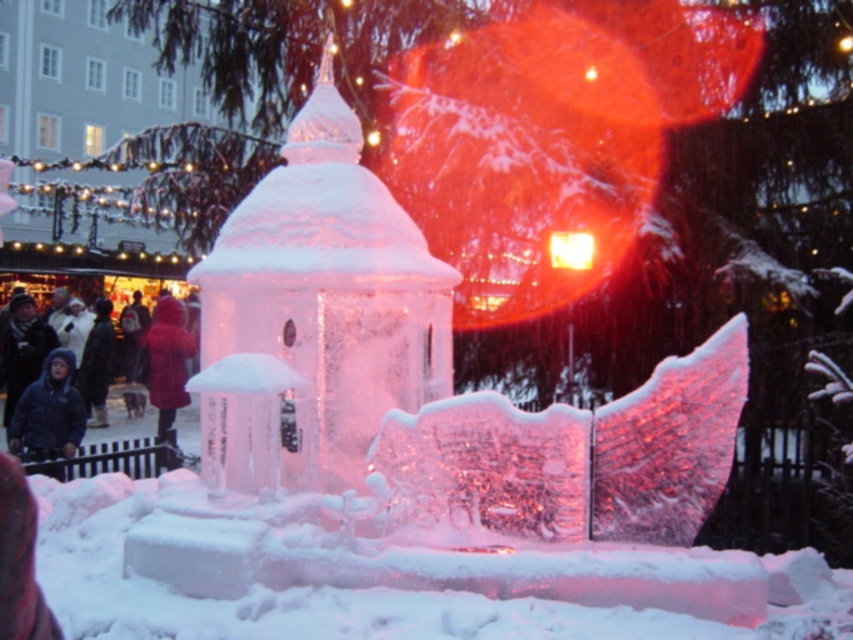
Is blue woolen jacket at lower left taller than red wool coat at center?

Incorrect, blue woolen jacket at lower left's height is not larger of red wool coat at center's.

Is blue woolen jacket at lower left positioned at the back of red wool coat at center?

No, blue woolen jacket at lower left is closer to the viewer.

Is point (22, 390) in front of point (157, 321)?

That is True.

This screenshot has height=640, width=853. In order to click on blue woolen jacket at lower left in this screenshot , I will do `click(28, 422)`.

Does icy white snow at center have a lesser width compared to red wool coat at center?

Incorrect, icy white snow at center's width is not less than red wool coat at center's.

Who is taller, icy white snow at center or red wool coat at center?

With more height is red wool coat at center.

Between point (453, 627) and point (164, 436), which one is positioned behind?

The point (164, 436) is more distant.

The image size is (853, 640). Find the location of `icy white snow at center`. icy white snow at center is located at coordinates (358, 589).

Find the location of a particular element. The image size is (853, 640). icy white snow at center is located at coordinates (358, 589).

Does point (560, 637) come behind point (155, 468)?

No, (560, 637) is in front of (155, 468).

Locate an element on the screen. The height and width of the screenshot is (640, 853). icy white snow at center is located at coordinates (358, 589).